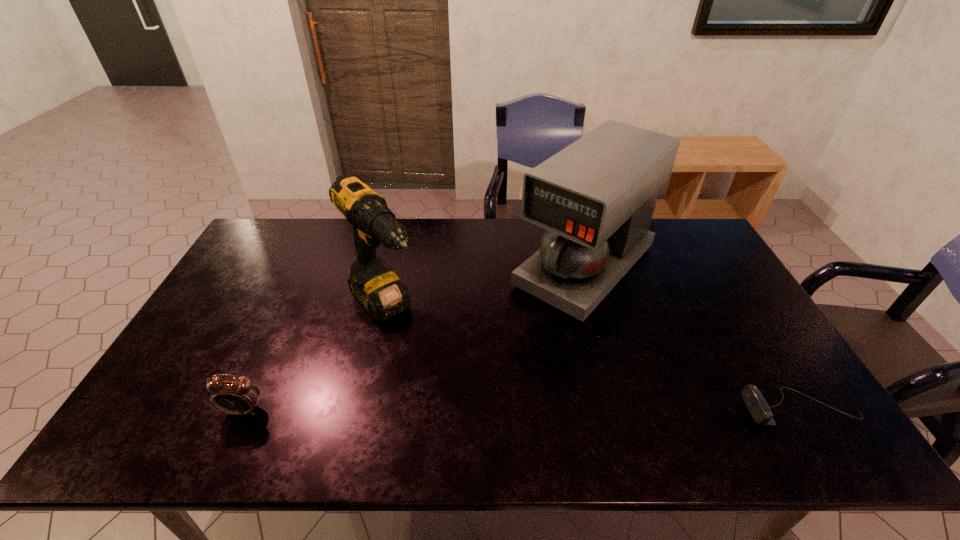
At what (x,y) coordinates should I click in order to perform the action: click on vacant space on the desktop that is between the alarm clock and the rightmost object and is positioned on the carafe side of the coffee maker. Please return your answer as a coordinate pair (x, y). Looking at the image, I should click on (439, 410).

Locate an element on the screen. vacant spot on the desktop that is between the second shortest object and the rightmost object and is positioned at the tip of the second object from left to right is located at coordinates (487, 410).